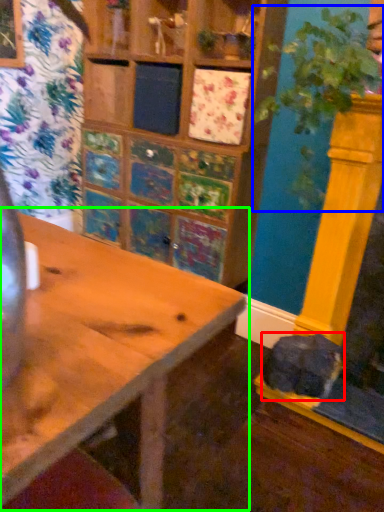
Question: Considering the real-world distances, which object is farthest from animal (highlighted by a red box)? plant (highlighted by a blue box) or table (highlighted by a green box)?

Choices:
 (A) plant
 (B) table

Answer: (B)